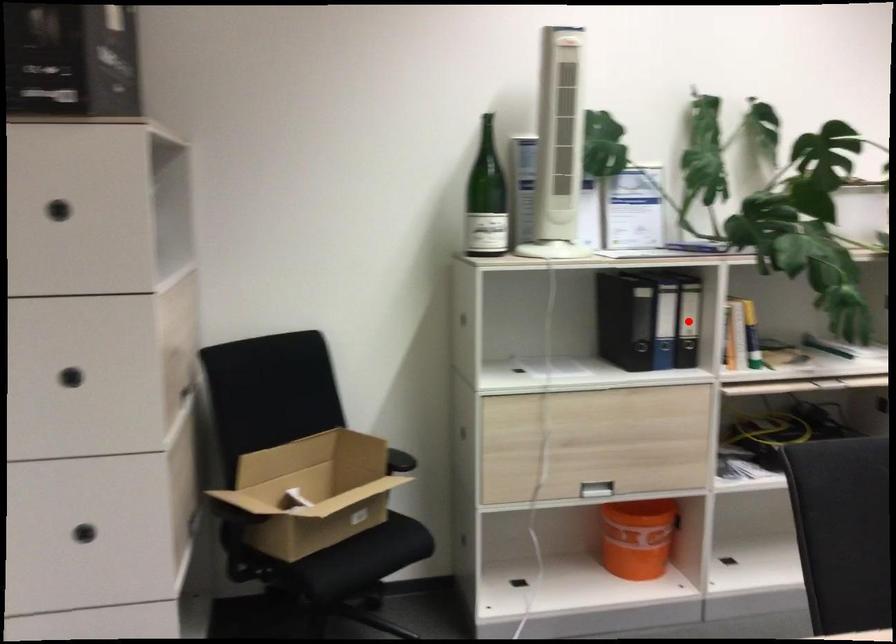
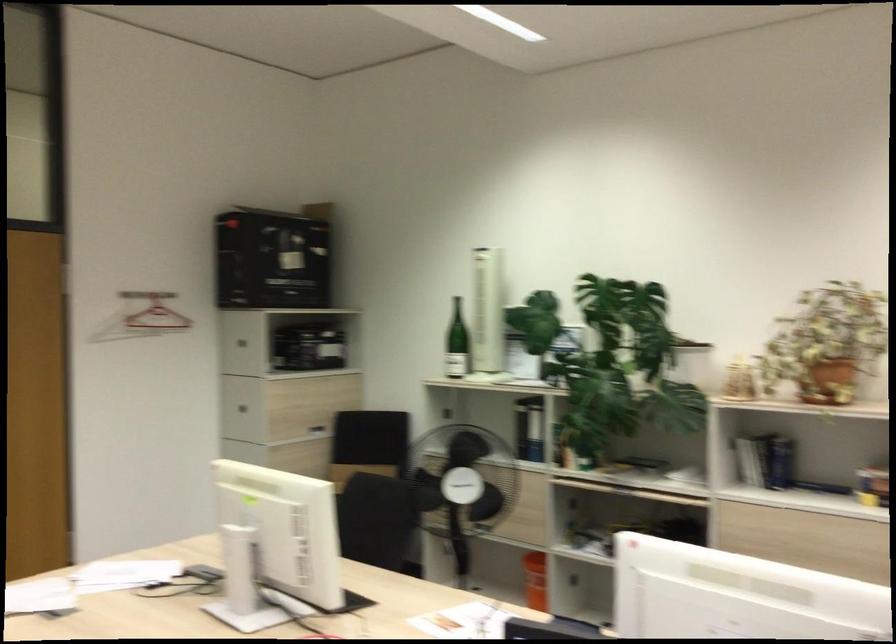
Question: I am providing you with two images of the same scene from different viewpoints. A red point is marked on the first image. Can you still see the location of the red point in image 2?

Choices:
 (A) Yes
 (B) No

Answer: (B)